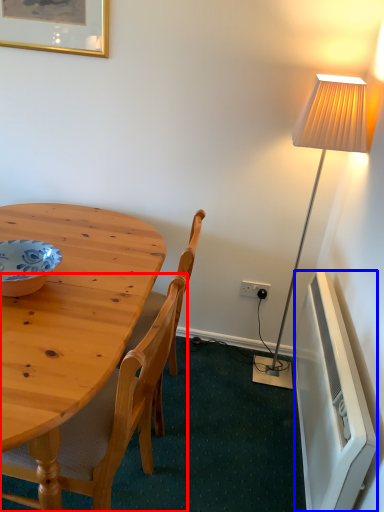
Question: Which object appears closest to the camera in this image, chair (highlighted by a red box) or radiator (highlighted by a blue box)?

Choices:
 (A) chair
 (B) radiator

Answer: (A)